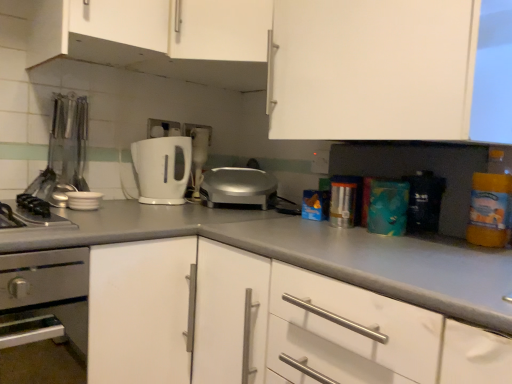
Where is `free spot to the left of translucent plastic bottle at right`? This screenshot has height=384, width=512. free spot to the left of translucent plastic bottle at right is located at coordinates (433, 239).